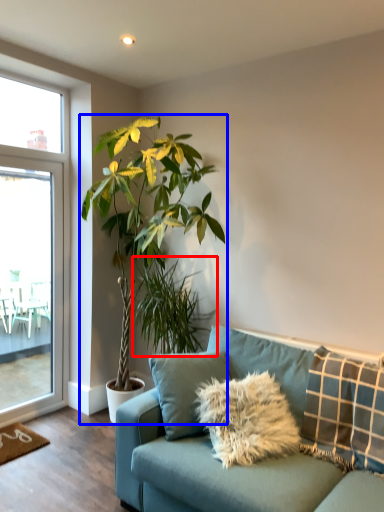
Question: Which of the following is the closest to the observer, houseplant (highlighted by a red box) or houseplant (highlighted by a blue box)?

Choices:
 (A) houseplant
 (B) houseplant

Answer: (B)